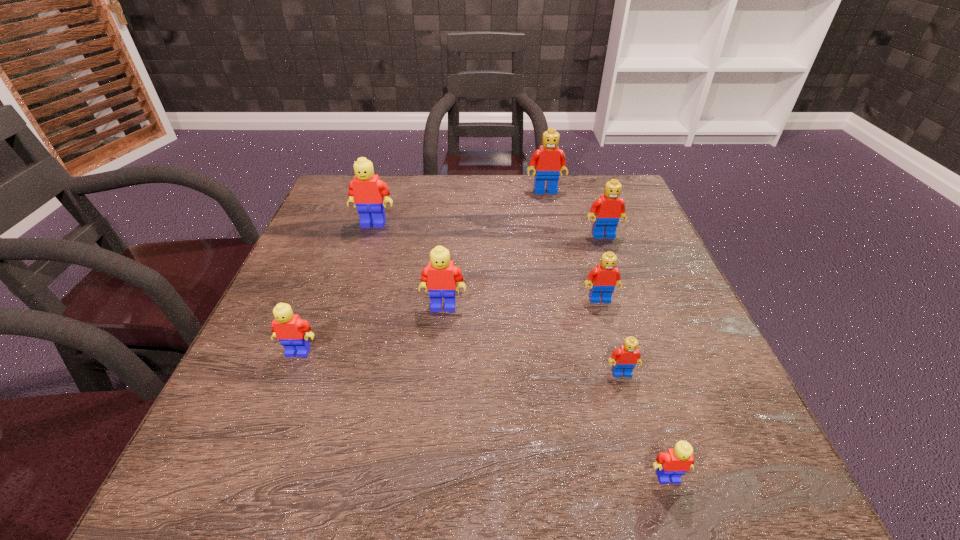
Point out which Lego is positioned as the fourth nearest to the nearest red Lego. Please provide its 2D coordinates. Your answer should be formatted as a tuple, i.e. [(x, y)], where the tuple contains the x and y coordinates of a point satisfying the conditions above.

[(609, 208)]

Identify the location of the fifth closest Lego to the second nearest red Lego. This screenshot has width=960, height=540. (549, 160).

Find the location of a particular element. This screenshot has height=540, width=960. the second closest red Lego relative to the sixth nearest object is located at coordinates [x=605, y=277].

This screenshot has width=960, height=540. What are the coordinates of `red Lego that is the second closest to the second nearest yellow Lego` in the screenshot? It's located at (605, 277).

Identify the location of yellow Lego that is the closest to the third nearest yellow Lego. This screenshot has width=960, height=540. (292, 332).

Locate which yellow Lego is the closest to the sixth object from right to left. Please provide its 2D coordinates. Your answer should be formatted as a tuple, i.e. [(x, y)], where the tuple contains the x and y coordinates of a point satisfying the conditions above.

[(292, 332)]